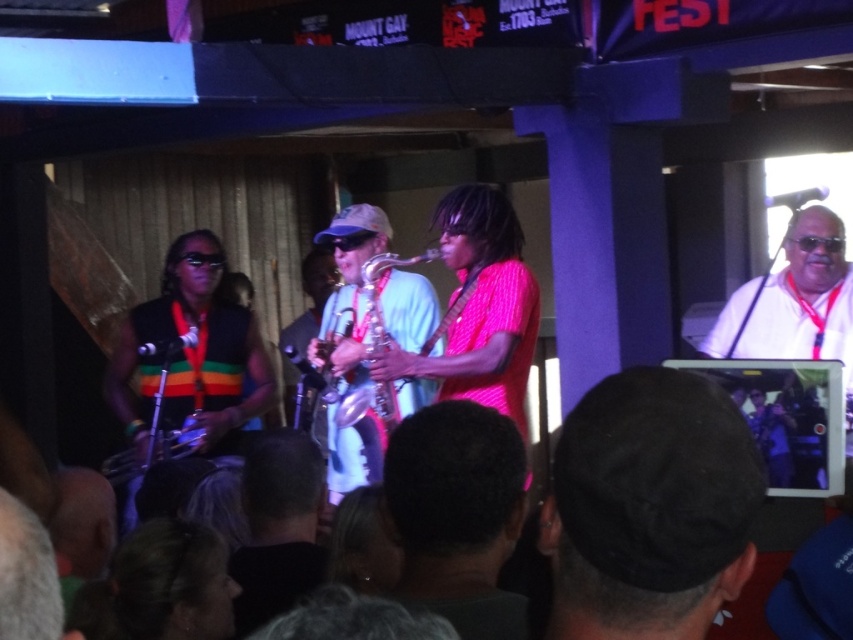
Does silver metallic saxophone at center have a smaller size compared to metallic silver saxophone at center?

No, silver metallic saxophone at center is not smaller than metallic silver saxophone at center.

Is silver metallic saxophone at center taller than metallic silver saxophone at center?

Yes, silver metallic saxophone at center is taller than metallic silver saxophone at center.

Who is more forward, (x=364, y=289) or (x=107, y=477)?

Point (x=364, y=289) is more forward.

This screenshot has height=640, width=853. What are the coordinates of `silver metallic saxophone at center` in the screenshot? It's located at pos(370,406).

Can you confirm if dark brown leather jacket at center is positioned above silver metallic saxophone at center?

No, dark brown leather jacket at center is not above silver metallic saxophone at center.

Between point (235, 618) and point (387, 256), which one is positioned behind?

The point (387, 256) is more distant.

Find the location of a particular element. The width and height of the screenshot is (853, 640). dark brown leather jacket at center is located at coordinates (277, 525).

Describe the element at coordinates (457, 515) in the screenshot. I see `dark brown hair at center` at that location.

Which is more to the right, dark brown hair at center or silver metallic saxophone at center?

dark brown hair at center is more to the right.

Who is more forward, (463, 614) or (372, 417)?

Point (463, 614)

The image size is (853, 640). Find the location of `dark brown hair at center`. dark brown hair at center is located at coordinates (457, 515).